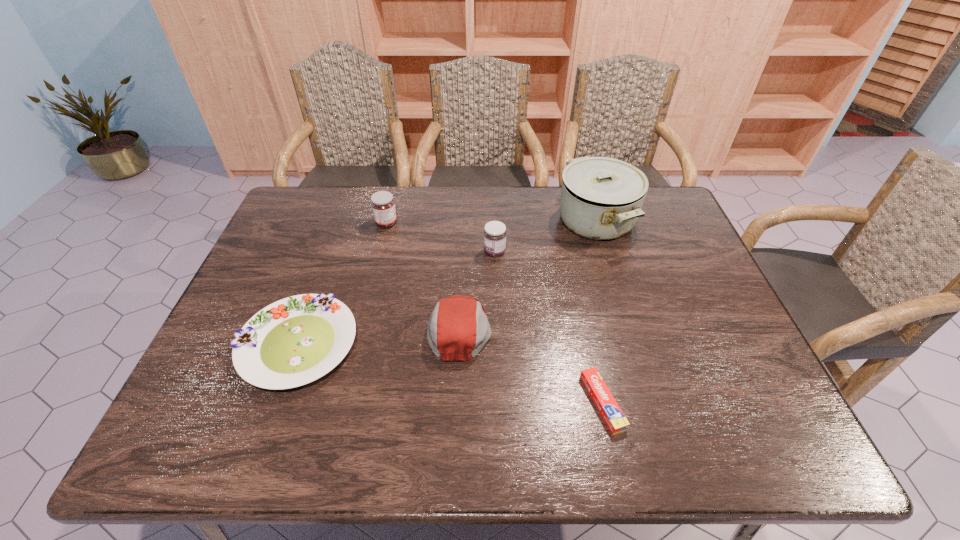
The image size is (960, 540). In order to click on free space at the far edge in this screenshot , I will do `click(404, 209)`.

This screenshot has width=960, height=540. Find the location of `free space at the near edge`. free space at the near edge is located at coordinates (334, 436).

In the image, there is a desktop. Where is `vacant space at the left edge`? This screenshot has width=960, height=540. vacant space at the left edge is located at coordinates (250, 296).

Locate an element on the screen. The image size is (960, 540). vacant space at the right edge of the desktop is located at coordinates (656, 276).

The width and height of the screenshot is (960, 540). Identify the location of vacant position at the far left corner of the desktop. (299, 191).

Locate an element on the screen. vacant space at the near left corner is located at coordinates (195, 420).

Find the location of a particular element. The width and height of the screenshot is (960, 540). vacant space at the far right corner of the desktop is located at coordinates coord(648,202).

This screenshot has height=540, width=960. I want to click on vacant space at the near right corner, so click(722, 428).

Find the location of a particular element. This screenshot has width=960, height=540. vacant space in between the farther jam and the cap is located at coordinates (423, 276).

Where is `free spot between the nearer jam and the shortest object`? The image size is (960, 540). free spot between the nearer jam and the shortest object is located at coordinates tap(548, 327).